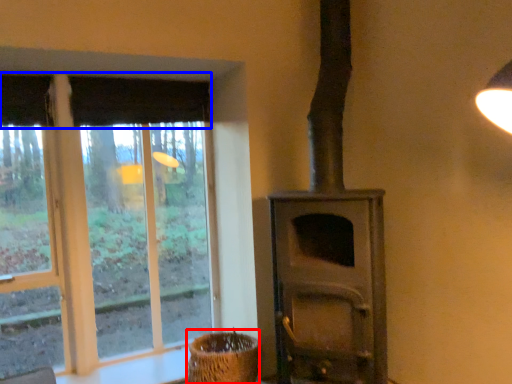
Question: Which object is further to the camera taking this photo, basket (highlighted by a red box) or curtain (highlighted by a blue box)?

Choices:
 (A) basket
 (B) curtain

Answer: (B)